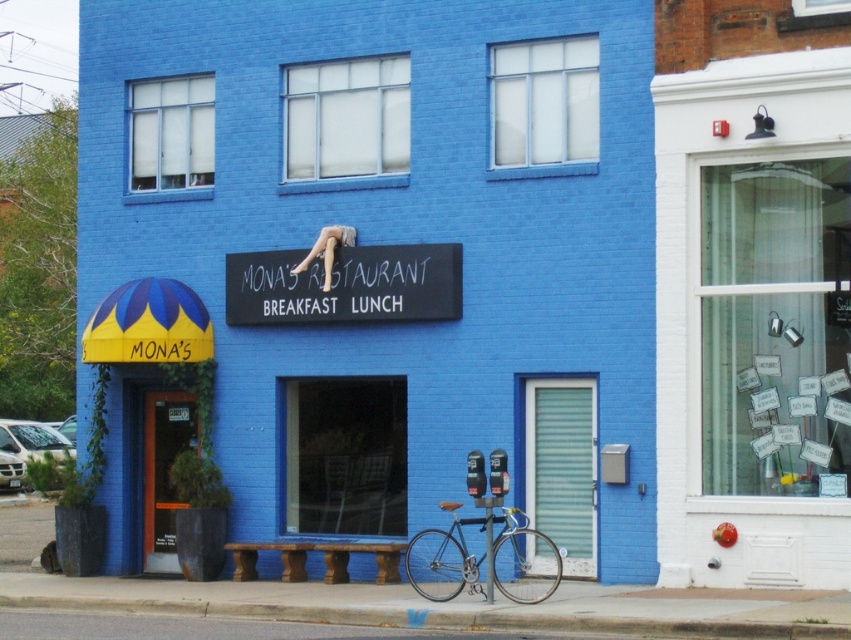
Question: Which point is farther to the camera?

Choices:
 (A) matte blue building at center
 (B) white chalkboard sign at center
 (C) shiny silver bicycle at lower center

Answer: (B)

Question: Can you confirm if white chalkboard sign at center is positioned to the right of shiny silver bicycle at lower center?

Choices:
 (A) no
 (B) yes

Answer: (A)

Question: Does matte blue building at center have a greater width compared to shiny silver bicycle at lower center?

Choices:
 (A) yes
 (B) no

Answer: (B)

Question: Considering the real-world distances, which object is closest to the matte blue building at center?

Choices:
 (A) shiny silver bicycle at lower center
 (B) white chalkboard sign at center

Answer: (A)

Question: Does matte blue building at center have a lesser width compared to shiny silver bicycle at lower center?

Choices:
 (A) yes
 (B) no

Answer: (A)

Question: Among these points, which one is farthest from the camera?

Choices:
 (A) (423, 380)
 (B) (553, 582)

Answer: (A)